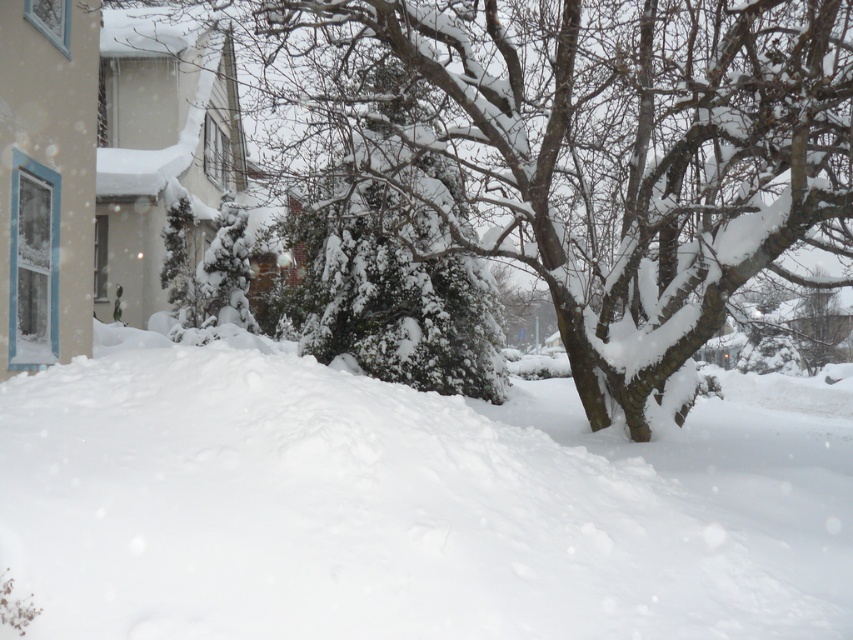
Question: Among these points, which one is nearest to the camera?

Choices:
 (A) (323, 508)
 (B) (718, 180)

Answer: (A)

Question: Is white fluffy snow at center thinner than snow-covered tree at center?

Choices:
 (A) no
 (B) yes

Answer: (A)

Question: Does white fluffy snow at center come behind snow-covered tree at center?

Choices:
 (A) yes
 (B) no

Answer: (B)

Question: In this image, where is white fluffy snow at center located relative to snow-covered tree at center?

Choices:
 (A) below
 (B) above

Answer: (A)

Question: Which object appears farthest from the camera in this image?

Choices:
 (A) white fluffy snow at center
 (B) snow-covered tree at center

Answer: (B)